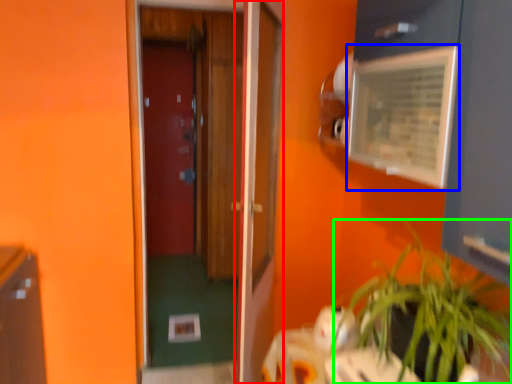
Question: Which object is the farthest from door (highlighted by a red box)? Choose among these: medicine cabinet (highlighted by a blue box) or houseplant (highlighted by a green box).

Choices:
 (A) medicine cabinet
 (B) houseplant

Answer: (B)